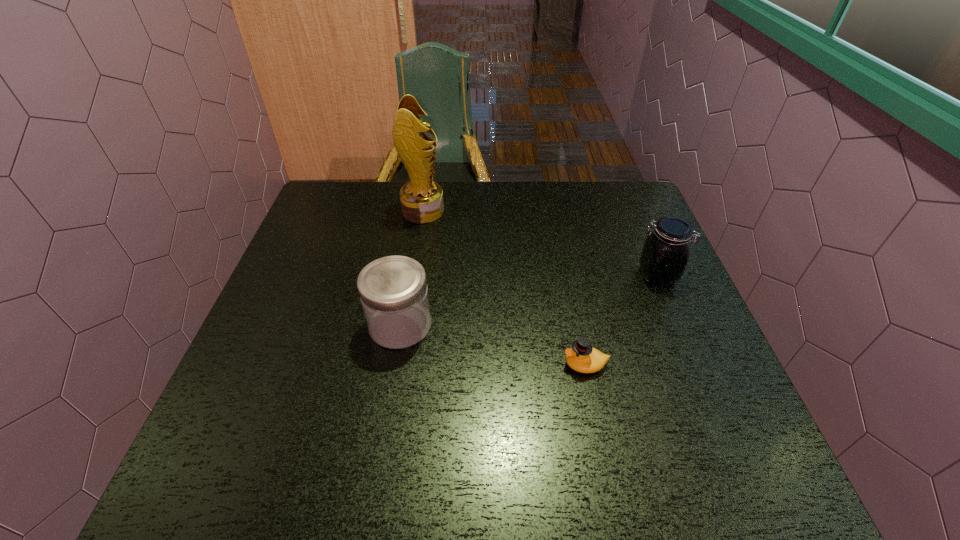
Locate an element on the screen. The height and width of the screenshot is (540, 960). award is located at coordinates (421, 198).

Where is `the farthest object`? This screenshot has height=540, width=960. the farthest object is located at coordinates (421, 198).

At what (x,y) coordinates should I click in order to perform the action: click on the farther jar. Please return your answer as a coordinate pair (x, y). The image size is (960, 540). Looking at the image, I should click on (665, 254).

Where is `the third nearest object`? the third nearest object is located at coordinates (665, 254).

The width and height of the screenshot is (960, 540). I want to click on the nearer jar, so click(x=393, y=290).

This screenshot has height=540, width=960. I want to click on the third farthest object, so click(x=393, y=290).

You are a GUI agent. You are given a task and a screenshot of the screen. Output one action in this format:
    pyautogui.click(x=<x>, y=<y>)
    Task: Click on the nearest object
    The image size is (960, 540).
    Given the screenshot: What is the action you would take?
    pyautogui.click(x=581, y=357)

Where is `the second object from right to left`? The height and width of the screenshot is (540, 960). the second object from right to left is located at coordinates (581, 357).

Where is `vacant area located 0.070m on the front-facing side of the farthest object`? vacant area located 0.070m on the front-facing side of the farthest object is located at coordinates (467, 211).

In order to click on vacant region located 0.270m on the lid of the second farthest object in this screenshot , I will do `click(532, 275)`.